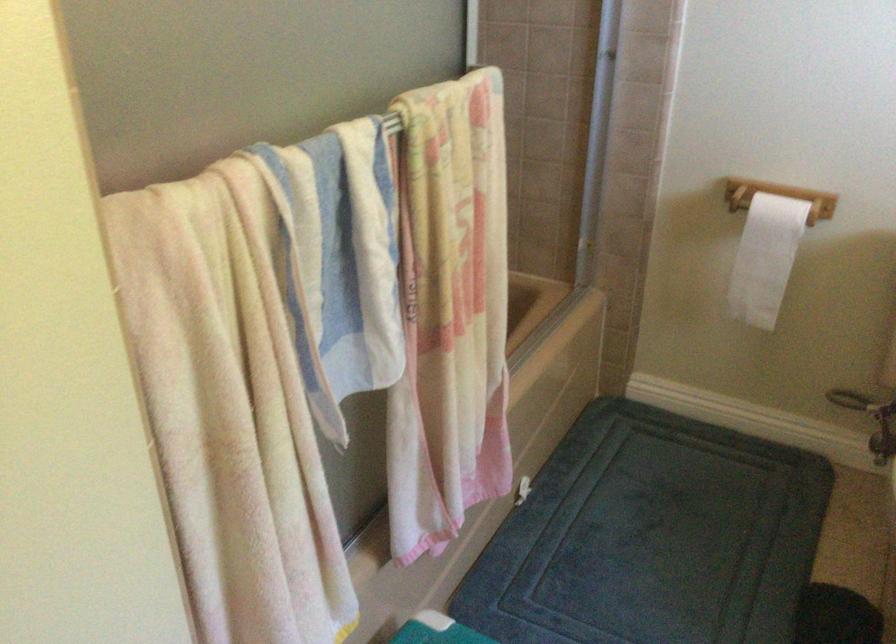
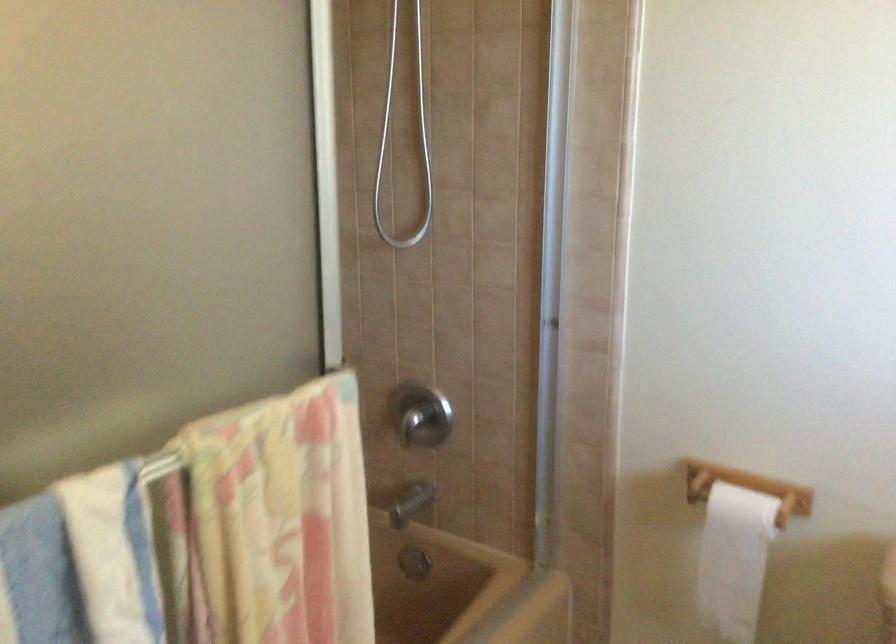
Question: How did the camera likely rotate?

Choices:
 (A) Left
 (B) Right
 (C) Up
 (D) Down

Answer: (C)